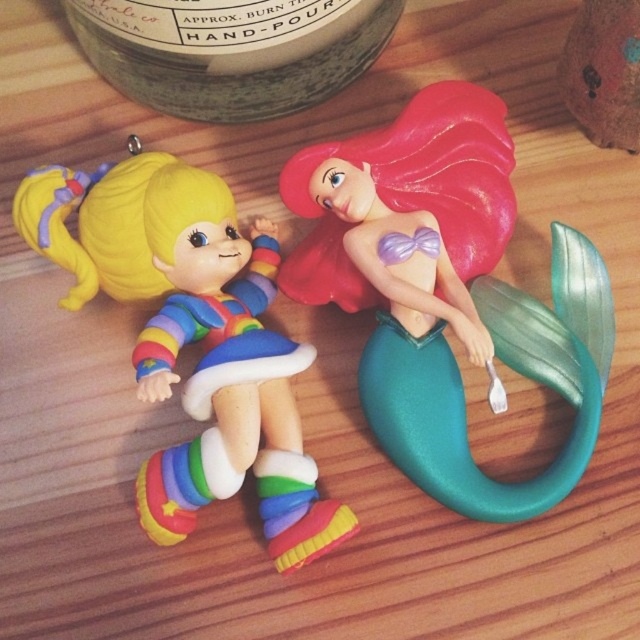
Can you confirm if rainbow plastic doll at left is wider than green matte jar at upper center?

No, rainbow plastic doll at left is not wider than green matte jar at upper center.

Which is above, rainbow plastic doll at left or green matte jar at upper center?

green matte jar at upper center

The height and width of the screenshot is (640, 640). Find the location of `rainbow plastic doll at left`. rainbow plastic doll at left is located at coordinates (193, 339).

Where is `rainbow plastic doll at left`? rainbow plastic doll at left is located at coordinates [193, 339].

Does shiny plastic mermaid at center have a greater width compared to rainbow plastic doll at left?

No, shiny plastic mermaid at center is not wider than rainbow plastic doll at left.

Which is in front, point (442, 365) or point (125, 182)?

Point (125, 182) is more forward.

At what (x,y) coordinates should I click in order to perform the action: click on shiny plastic mermaid at center. Please return your answer as a coordinate pair (x, y). The width and height of the screenshot is (640, 640). Looking at the image, I should click on (468, 292).

Which of these two, shiny plastic mermaid at center or matte brown wooden toy at upper right, stands taller?

With more height is shiny plastic mermaid at center.

Does shiny plastic mermaid at center come in front of matte brown wooden toy at upper right?

That is False.

Which is in front, point (518, 346) or point (586, 42)?

Point (586, 42)

You are a GUI agent. You are given a task and a screenshot of the screen. Output one action in this format:
    pyautogui.click(x=<x>, y=<y>)
    Task: Click on the shiny plastic mermaid at center
    This screenshot has height=640, width=640.
    Given the screenshot: What is the action you would take?
    pyautogui.click(x=468, y=292)